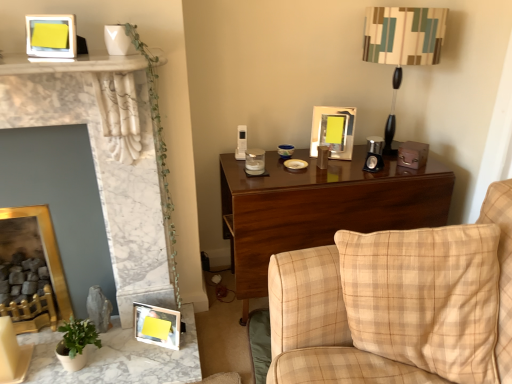
This screenshot has width=512, height=384. What are the coordinates of `vacant space in front of wooden photo frame at lower left, which is the 3th picture frame from left to right` in the screenshot? It's located at (152, 363).